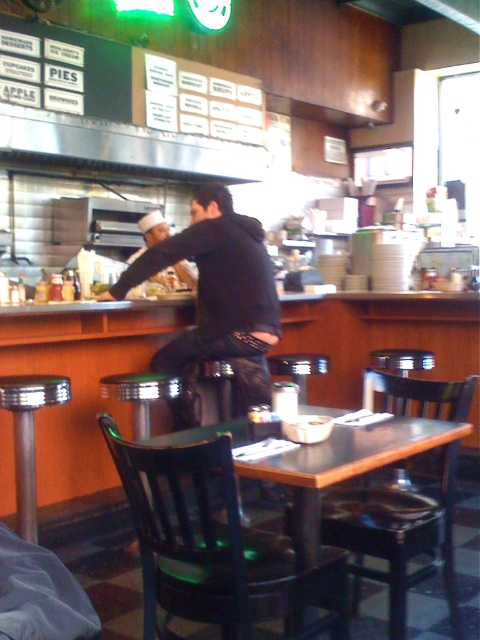
In the scene shown: You are a person who is 5 feet tall and want to sit on one of the bar stools at the lower left. The shiny chrome bar stool at lower left and the brushed metal bar stool at lower left are both available. Considering your height, which stool would be easier for you to climb onto?

Both the shiny chrome bar stool at lower left and the brushed metal bar stool at lower left are 14.88 inches apart, so their proximity to you is the same. However, since you are 5 feet tall, the height of the stools, not the distance between them, would determine ease of climbing. The description does not provide height information, so I cannot determine which is easier based on the given data.

You are a customer at the diner and want to sit on one of the bar stools at the counter. The shiny chrome bar stool at lower left and the brushed metal bar stool at lower left are available. If you prefer a more spacious seating option, which one should you choose?

The shiny chrome bar stool at lower left has a larger size compared to the brushed metal bar stool at lower left, so you should choose the shiny chrome bar stool at lower left for a more spacious seating option.

You are a diner patron who wants to sit down. You see a black wood chair at lower center and a brushed metal bar stool at lower left. Which seat is located underneath the other?

The black wood chair at lower center is positioned under the brushed metal bar stool at lower left.